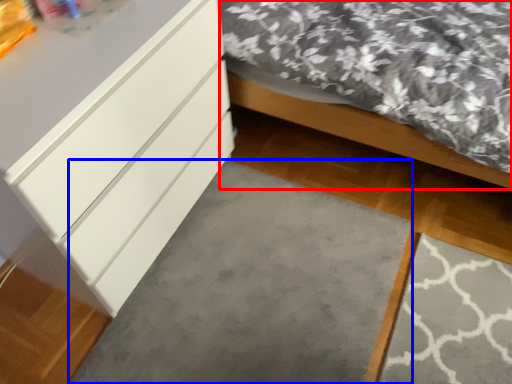
Question: Which point is further to the camera, bed (highlighted by a red box) or concrete (highlighted by a blue box)?

Choices:
 (A) bed
 (B) concrete

Answer: (B)